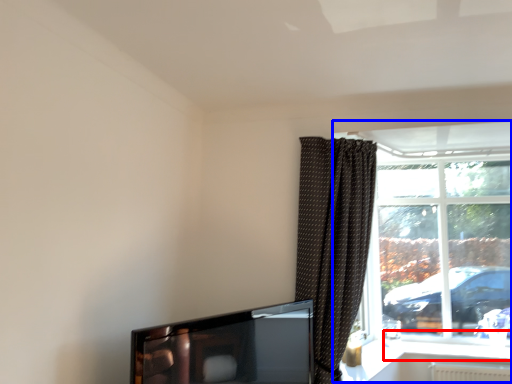
Question: Among these objects, which one is farthest to the camera, window sill (highlighted by a red box) or window (highlighted by a blue box)?

Choices:
 (A) window sill
 (B) window

Answer: (B)